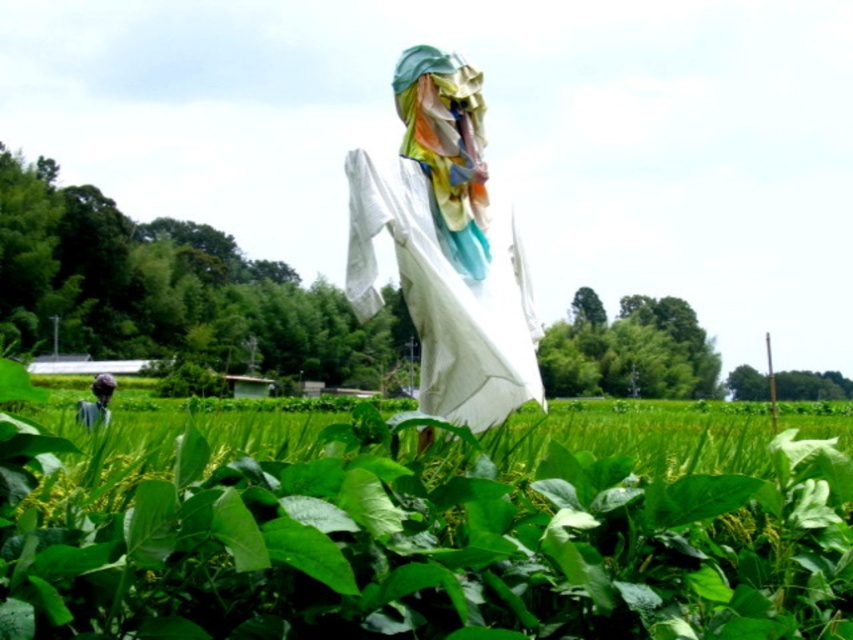
Question: Can you confirm if white cloth at center is thinner than dark blue fabric at lower left?

Choices:
 (A) yes
 (B) no

Answer: (A)

Question: Does white cloth at center appear on the right side of dark blue fabric at lower left?

Choices:
 (A) no
 (B) yes

Answer: (B)

Question: Which of the following is the farthest from the observer?

Choices:
 (A) (379, 220)
 (B) (102, 413)

Answer: (B)

Question: Is white cloth at center above dark blue fabric at lower left?

Choices:
 (A) yes
 (B) no

Answer: (A)